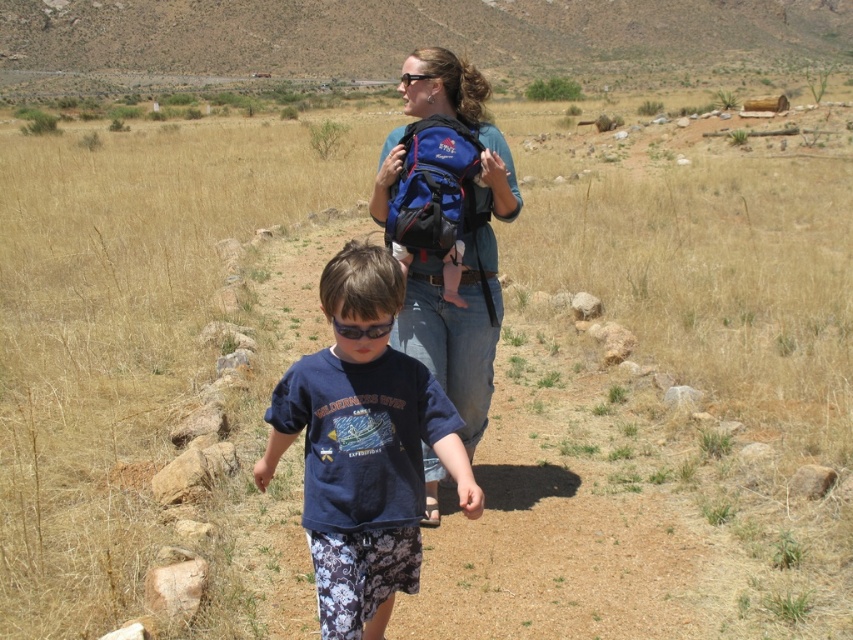
Question: Is blue cotton shirt at center smaller than blue fabric backpack at center?

Choices:
 (A) no
 (B) yes

Answer: (A)

Question: Which point is closer to the camera?

Choices:
 (A) (436, 320)
 (B) (352, 420)

Answer: (B)

Question: Can you confirm if blue fabric backpack at upper center is positioned above blue fabric backpack at center?

Choices:
 (A) no
 (B) yes

Answer: (A)

Question: Observing the image, what is the correct spatial positioning of blue cotton shirt at center in reference to blue fabric backpack at center?

Choices:
 (A) left
 (B) right

Answer: (A)

Question: Which object is closer to the camera taking this photo?

Choices:
 (A) blue fabric backpack at upper center
 (B) blue fabric backpack at center

Answer: (A)

Question: Which point is farther to the camera?

Choices:
 (A) blue fabric backpack at upper center
 (B) blue fabric backpack at center
 (C) blue cotton shirt at center

Answer: (B)